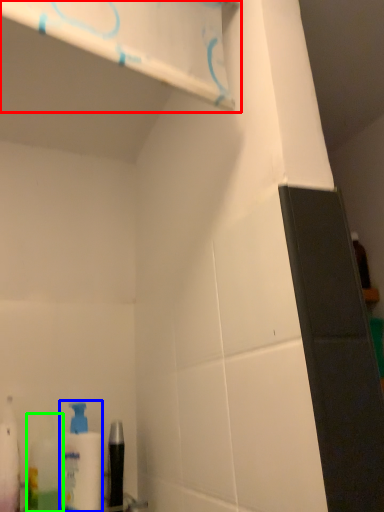
Question: Considering the real-world distances, which object is closest to shelf (highlighted by a red box)? cleaning product (highlighted by a blue box) or mouthwash (highlighted by a green box).

Choices:
 (A) cleaning product
 (B) mouthwash

Answer: (A)